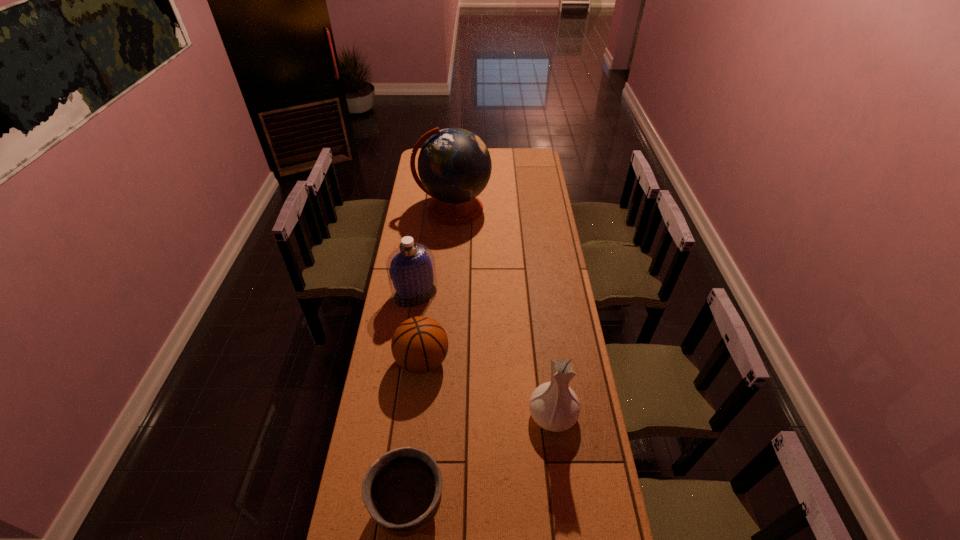
Identify the location of vacant area that lies between the cleansing agent and the rightmost object. The width and height of the screenshot is (960, 540). (484, 354).

You are a GUI agent. You are given a task and a screenshot of the screen. Output one action in this format:
    pyautogui.click(x=<x>, y=<y>)
    Task: Click on the empty space that is in between the globe and the rightmost object
    The height and width of the screenshot is (540, 960).
    Given the screenshot: What is the action you would take?
    pyautogui.click(x=503, y=312)

This screenshot has height=540, width=960. In order to click on free area in between the third farthest object and the farthest object in this screenshot , I will do `click(438, 285)`.

Locate an element on the screen. object that can be found as the second closest to the basketball is located at coordinates (554, 406).

Identify which object is located as the fourth nearest to the third nearest object. Please provide its 2D coordinates. Your answer should be formatted as a tuple, i.e. [(x, y)], where the tuple contains the x and y coordinates of a point satisfying the conditions above.

[(454, 165)]

Where is `vacant region that satisfies the following two spatial constraints: 1. with the Americas facing the viewer on the vase; 2. on the right side of the globe`? vacant region that satisfies the following two spatial constraints: 1. with the Americas facing the viewer on the vase; 2. on the right side of the globe is located at coordinates (439, 414).